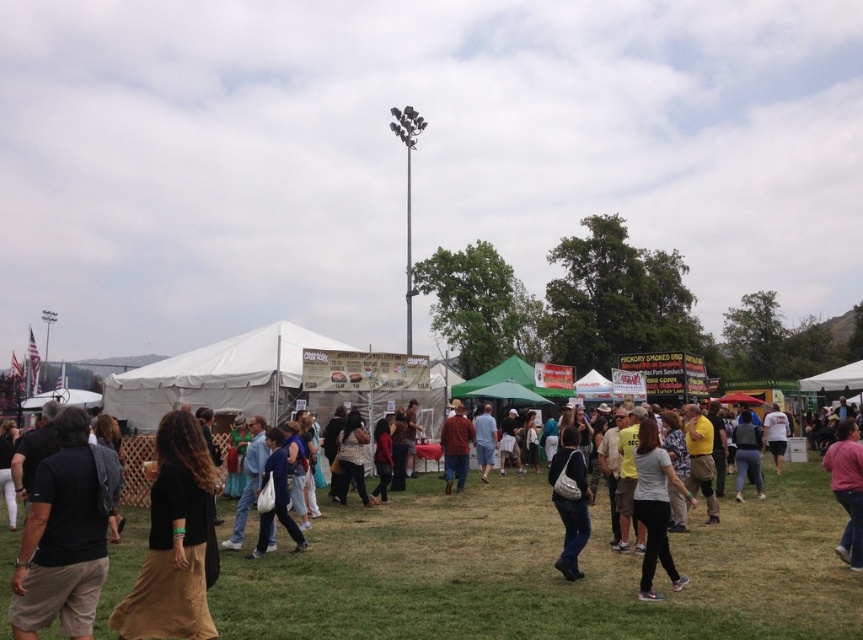
You are a photographer at the event and want to capture a photo of the matte red shirt at center and denim shorts at center. Which object should you zoom in on to ensure both are in focus?

The matte red shirt at center is bigger than denim shorts at center, so you should zoom in on the matte red shirt at center to ensure both are in focus.

You are standing at the edge of the grassy field and see the green grass at lower center and the denim shorts at center. Which object is nearer to you?

The green grass at lower center is closer to the viewer than the denim shorts at center, so the green grass at lower center is nearer to you.